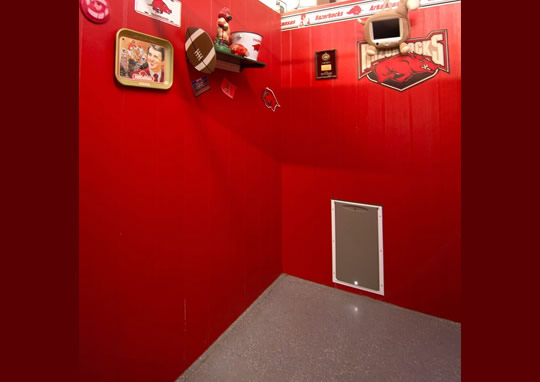
The image size is (540, 382). In order to click on walls in this screenshot , I will do `click(238, 263)`, `click(296, 171)`.